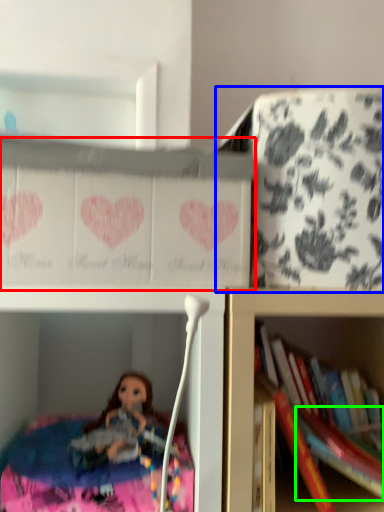
Question: Which object is the closest to the cabinet (highlighted by a red box)? Choose among these: cabinet (highlighted by a blue box) or book (highlighted by a green box).

Choices:
 (A) cabinet
 (B) book

Answer: (A)